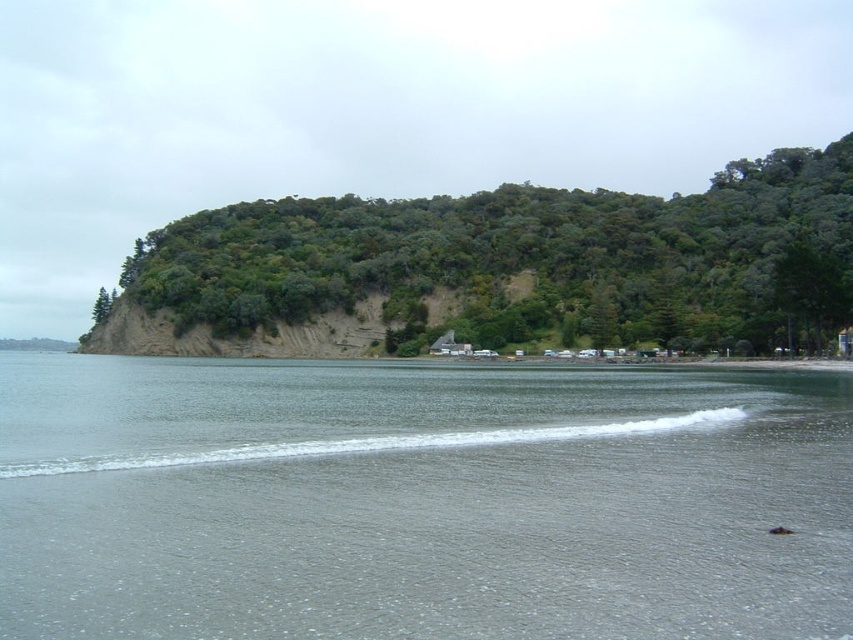
You are standing on the beach and see the gray water at lower center and the green leafy hillside at upper center. Which object is closer to your feet?

The gray water at lower center is closer to your feet because it is located below the green leafy hillside at upper center.

You are standing on the beach looking at the gray water at lower center and the green leafy hillside at upper center. Which object appears taller from your perspective?

The green leafy hillside at upper center appears taller than the gray water at lower center because the gray water at lower center is shorter than green leafy hillside at upper center.

You are standing at the point with coordinates point (131, 298) and want to walk towards the point with coordinates point (224, 497). Which direction should you face to move towards your destination?

You should face towards the direction of point (224, 497), which is in front of point (131, 298), so you need to walk forward in that direction.